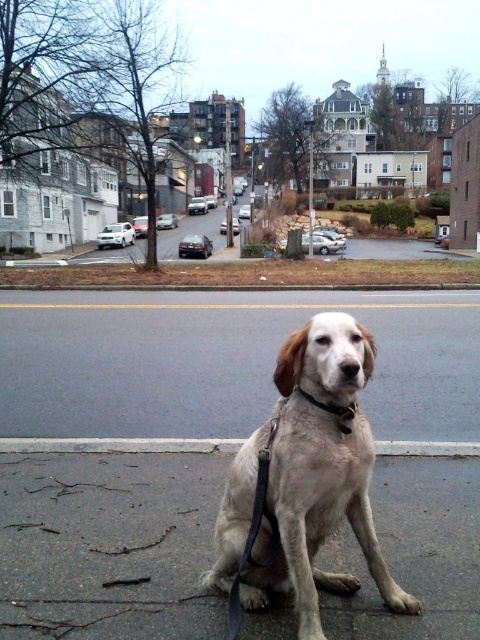
From the picture: Can you confirm if gray asphalt pavement at lower center is bigger than black leather neckband at center?

Correct, gray asphalt pavement at lower center is larger in size than black leather neckband at center.

Looking at this image, does gray asphalt pavement at lower center appear over black leather neckband at center?

No, gray asphalt pavement at lower center is not above black leather neckband at center.

Is point (216, 468) behind point (332, 404)?

That is True.

Find the location of a particular element. The height and width of the screenshot is (640, 480). gray asphalt pavement at lower center is located at coordinates (108, 545).

Can you confirm if gray asphalt at center is positioned to the left of light brown fur dog at center?

Correct, you'll find gray asphalt at center to the left of light brown fur dog at center.

Is point (462, 380) positioned before point (337, 314)?

No, it is not.

What do you see at coordinates (224, 362) in the screenshot? The height and width of the screenshot is (640, 480). I see `gray asphalt at center` at bounding box center [224, 362].

The height and width of the screenshot is (640, 480). What are the coordinates of `gray asphalt at center` in the screenshot? It's located at (224, 362).

Is gray asphalt pavement at lower center further to camera compared to gray concrete curb at lower center?

No, it is in front of gray concrete curb at lower center.

Is point (78, 627) behind point (225, 445)?

No, (78, 627) is in front of (225, 445).

The width and height of the screenshot is (480, 640). In order to click on gray asphalt pavement at lower center in this screenshot , I will do `click(108, 545)`.